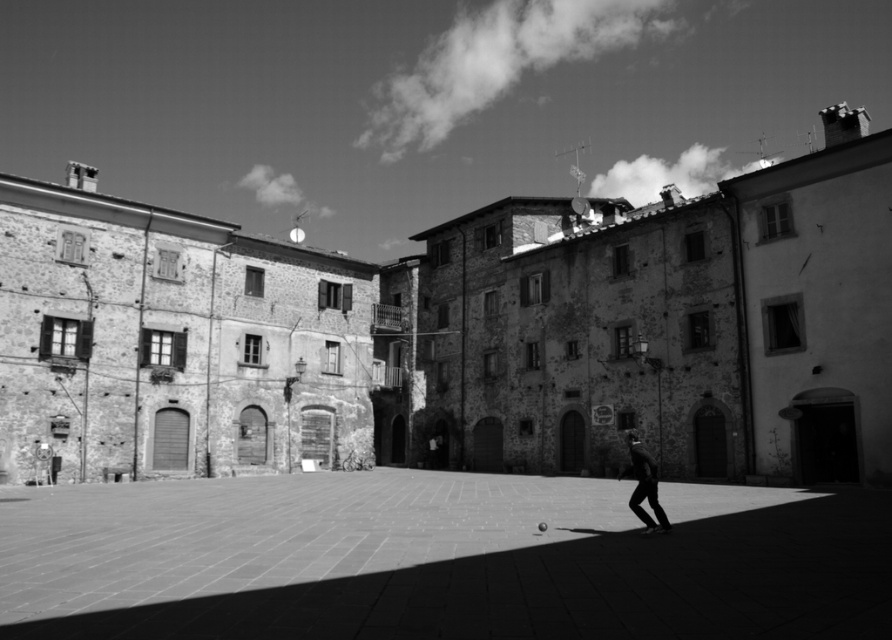
You are a delivery person needing to carry a large package through the square. The package is too big to fit through narrow spaces. Based on the image, which path should you choose between the smooth stone alley at center and the dark fabric pants at lower right?

The smooth stone alley at center is bigger than the dark fabric pants at lower right, so you should choose the smooth stone alley at center for your large package.

You are a tourist standing in the square and want to take a photo of the smooth stone alley at center without the dark fabric pants at lower right appearing in the frame. Which direction should you move to ensure the alley fills the frame and the pants are out of sight?

The smooth stone alley at center is taller than the dark fabric pants at lower right. To frame the alley without the pants, move upward or backward to focus on the taller alley while positioning yourself so the pants are no longer in view.

From the picture: You are a tourist in the town square and want to walk from the smooth stone alley at center to the dark fabric pants at lower right. Which direction should you move relative to the alley?

To move from the smooth stone alley at center to the dark fabric pants at lower right, you should move to the right since the dark fabric pants at lower right is on the right side of the alley.